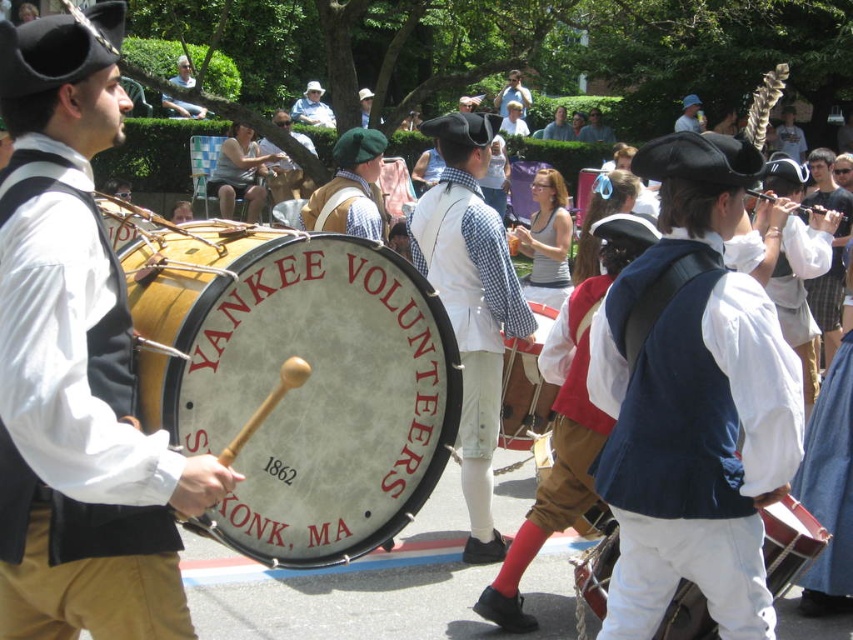
Question: Is matte white drum at center below blue denim hat at upper center?

Choices:
 (A) no
 (B) yes

Answer: (B)

Question: Is white leather drum at center to the left of light brown leather hat at upper center from the viewer's perspective?

Choices:
 (A) no
 (B) yes

Answer: (A)

Question: Estimate the real-world distances between objects in this image. Which object is farther from the matte white drum at center?

Choices:
 (A) white checkered shirt at center
 (B) blue denim hat at upper center
 (C) wooden drum at center
 (D) matte black vest at left

Answer: (B)

Question: Is white checkered shirt at center thinner than light brown leather hat at upper center?

Choices:
 (A) yes
 (B) no

Answer: (A)

Question: Estimate the real-world distances between objects in this image. Which object is farther from the white cotton hat at upper center?

Choices:
 (A) matte white drum at center
 (B) light brown leather hat at upper center
 (C) white checkered shirt at center

Answer: (C)

Question: Which of the following is the closest to the observer?

Choices:
 (A) wooden drum at center
 (B) white cotton hat at upper center
 (C) blue denim hat at upper center
 (D) matte white drum at center

Answer: (A)